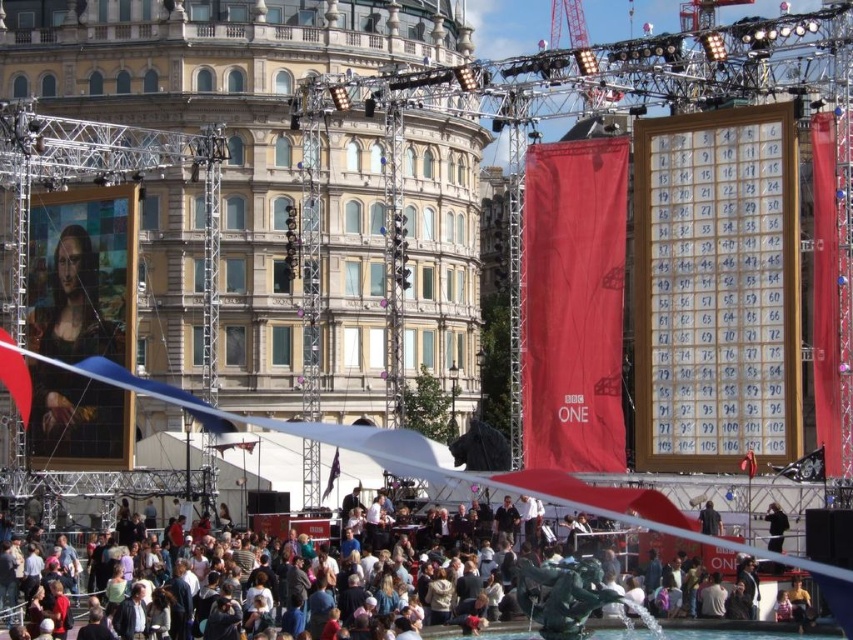
Who is more distant from viewer, (526, 589) or (776, 547)?

Point (776, 547)

Between dark gray fabric crowd at lower center and black fabric person at center, which one has more height?

dark gray fabric crowd at lower center is taller.

Between point (572, 627) and point (776, 538), which one is positioned behind?

The point (776, 538) is more distant.

Identify the location of dark gray fabric crowd at lower center. The width and height of the screenshot is (853, 640). (561, 595).

Based on the photo, which of these two, black fabric person at center or dark blue fabric at center, stands taller?

Standing taller between the two is black fabric person at center.

Who is lower down, black fabric person at center or dark blue fabric at center?

black fabric person at center

Does point (782, 524) come farther from viewer compared to point (717, 518)?

No, it is not.

Locate an element on the screen. This screenshot has height=640, width=853. black fabric person at center is located at coordinates (775, 525).

Does dark gray fabric crowd at lower center have a greater width compared to dark blue fabric at center?

Yes.

Does dark gray fabric crowd at lower center appear on the right side of dark blue fabric at center?

In fact, dark gray fabric crowd at lower center is to the left of dark blue fabric at center.

Where is `dark gray fabric crowd at lower center`? This screenshot has height=640, width=853. dark gray fabric crowd at lower center is located at coordinates (561, 595).

The height and width of the screenshot is (640, 853). What are the coordinates of `dark gray fabric crowd at lower center` in the screenshot? It's located at (561, 595).